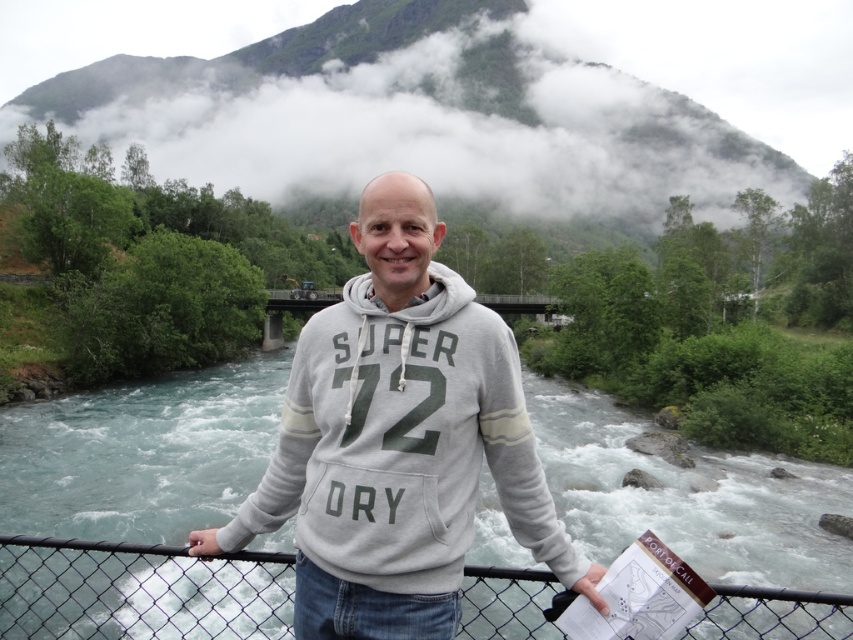
You are a photographer trying to capture the man in the gray cotton hoodie at center while also including the white fluffy cloud at upper center in the frame. Based on their positions, will you need to adjust your camera upwards or downwards to include both?

The white fluffy cloud at upper center is located above the gray cotton hoodie at center, so you will need to adjust your camera upwards to include both.

Based on the photo, you are a hiker who wants to cross from the bridge to the other side. The clear water at center and the wire mesh fence at center are both in your path. Which one is wider so you can walk around it more easily?

The clear water at center is wider than the wire mesh fence at center, so you can walk around it more easily.